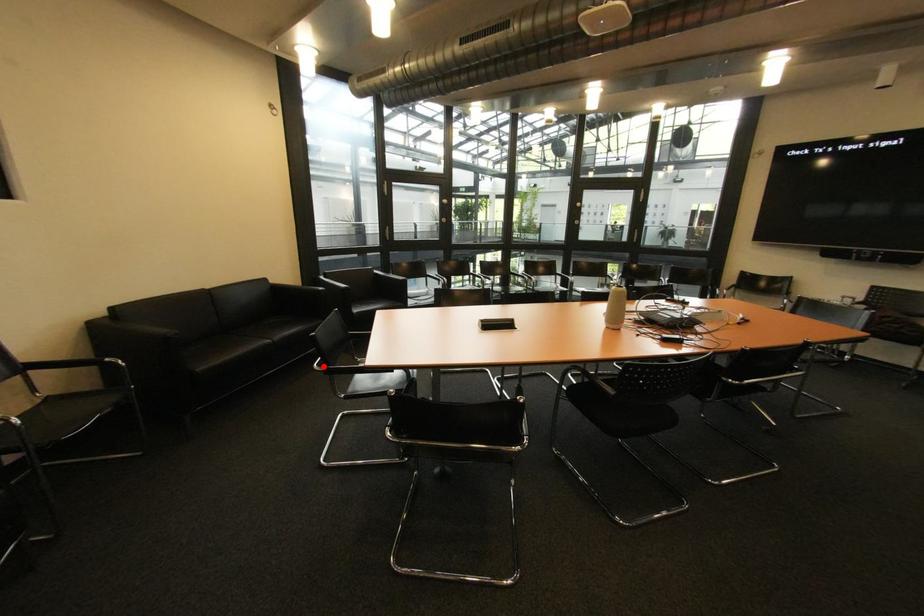
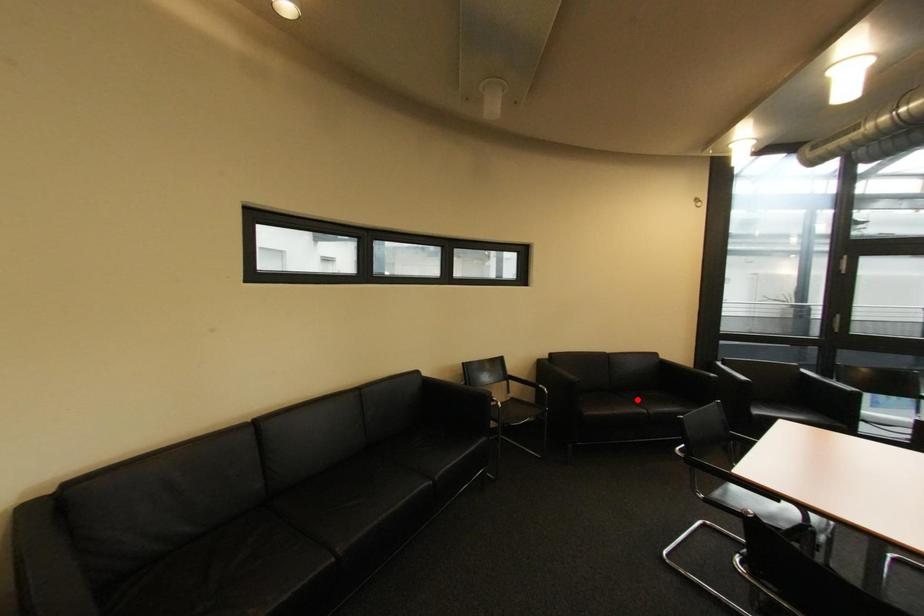
I am providing you with two images of the same scene from different viewpoints. A red point is marked on the first image and another point is marked on the second image. Is the marked point in image1 the same physical position as the marked point in image2?

No